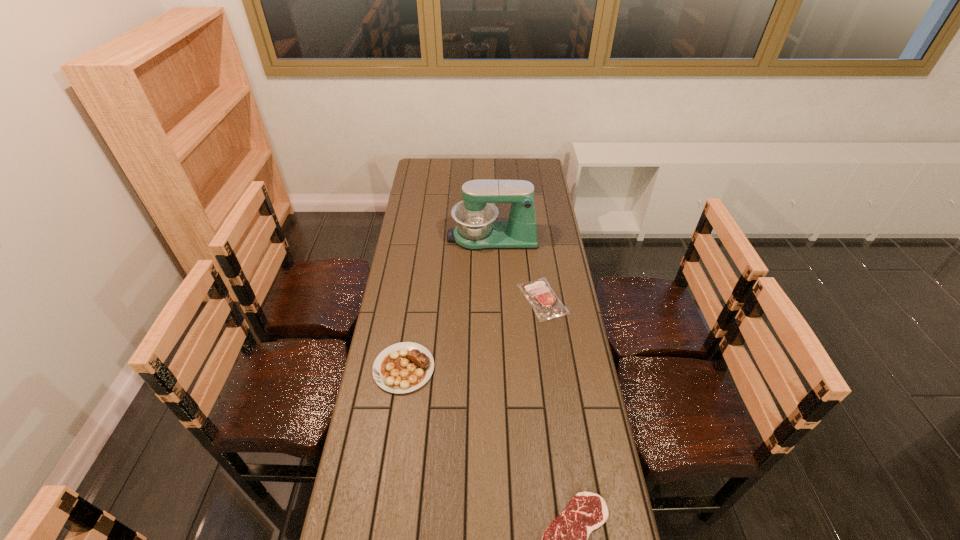
Locate an element on the screen. This screenshot has height=540, width=960. empty location between the tallest object and the second shortest steak is located at coordinates (517, 268).

Locate an element on the screen. The width and height of the screenshot is (960, 540). vacant region between the leftmost steak and the farthest steak is located at coordinates (473, 334).

Find the location of a particular element. object that is the second closest to the shortest object is located at coordinates (546, 305).

The height and width of the screenshot is (540, 960). Identify the location of the second closest object to the nearest object. pyautogui.click(x=546, y=305).

The height and width of the screenshot is (540, 960). I want to click on steak that stands as the second closest to the second tallest steak, so click(x=566, y=539).

Identify the location of the second closest steak relative to the leftmost steak. (566, 539).

Locate an element on the screen. vacant region that satisfies the following two spatial constraints: 1. on the front-facing side of the third tallest object; 2. on the left side of the mixer is located at coordinates (494, 299).

The width and height of the screenshot is (960, 540). Identify the location of vacant space that satisfies the following two spatial constraints: 1. on the front-facing side of the second shortest object; 2. on the right side of the farthest object. (494, 299).

This screenshot has width=960, height=540. Identify the location of free spot that satisfies the following two spatial constraints: 1. on the front-facing side of the farthest steak; 2. on the left side of the farthest object. (494, 299).

At what (x,y) coordinates should I click in order to perform the action: click on vacant area that satisfies the following two spatial constraints: 1. on the back side of the second tallest steak; 2. on the front-facing side of the tallest object. Please return your answer as a coordinate pair (x, y). The image size is (960, 540). Looking at the image, I should click on (534, 237).